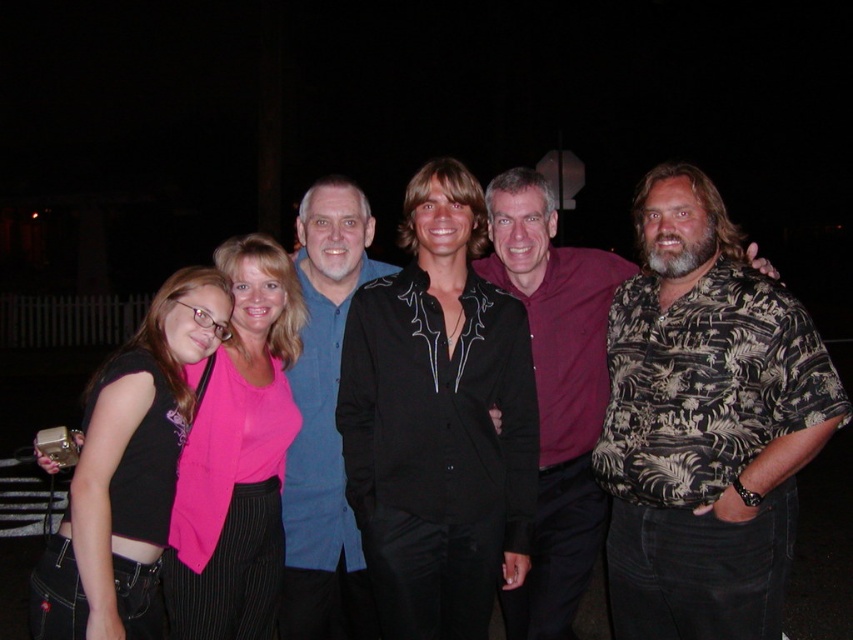
Looking at the group of people in the image, where is the printed fabric shirt at center compared to the black fabric shirt at left?

The printed fabric shirt at center is to the right of the black fabric shirt at left.

Based on the photo, you are a photographer setting up for a group photo. You need to ensure that the two black shirts in the scene are spaced exactly 1 meter apart for aesthetic purposes. The black satin shirt at center and the black fabric shirt at left are currently positioned how in terms of distance? Is the current spacing acceptable?

The black satin shirt at center is 1.07 meters from the black fabric shirt at left. Since the required distance is 1 meter, the current spacing is slightly over the desired distance but very close. It might be acceptable depending on the photographer preferences, but adjusting by 0.07 meters could make it precise.

In the scene shown: You are a photographer trying to adjust the lighting for a group photo. You notice two shirts in the center of the image, a printed fabric shirt at center and a black satin blouse at center. Which one is closer to the camera?

The printed fabric shirt at center is in front of the black satin blouse at center, so it is closer to the camera.